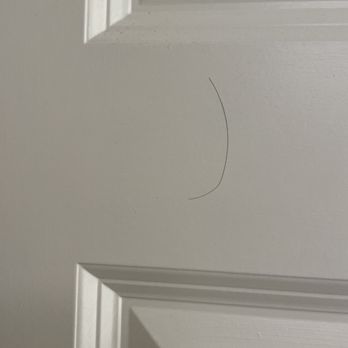
Identify the location of door. (140, 122).